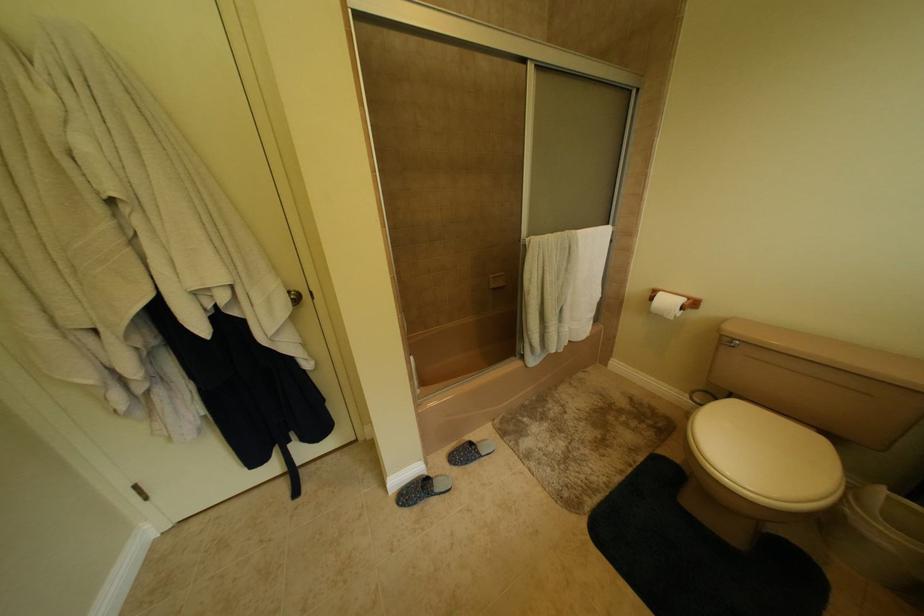
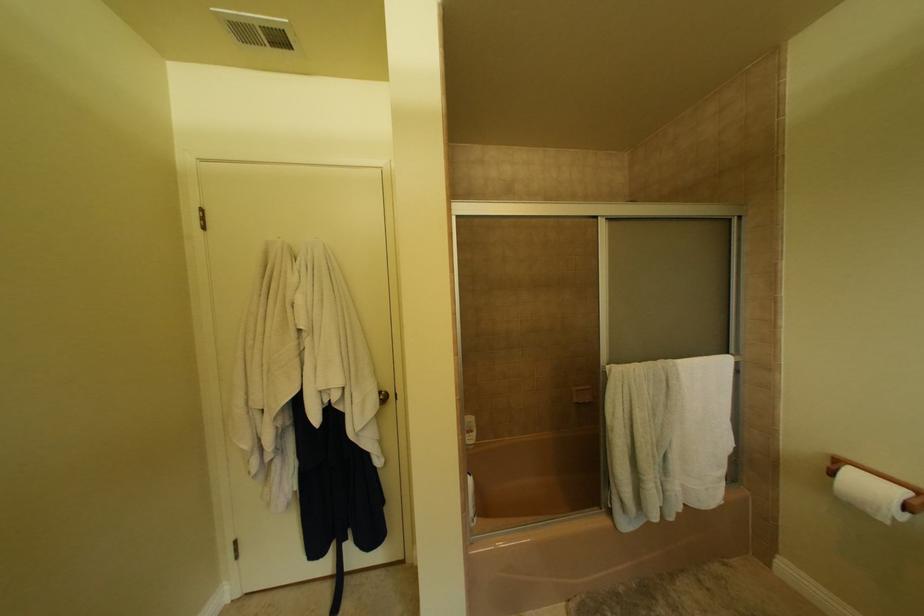
What movement of the cameraman would produce the second image?

The cameraman walked toward right, backward.